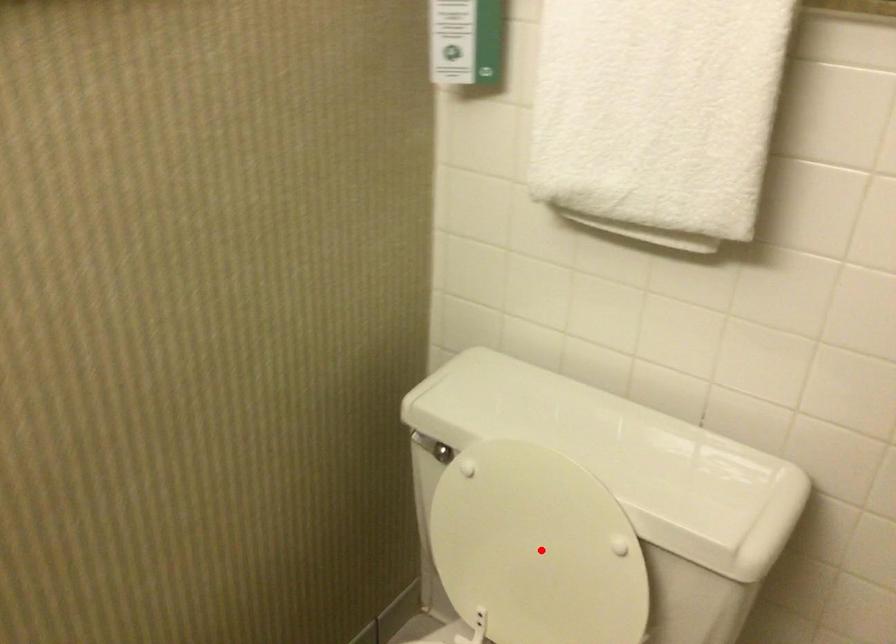
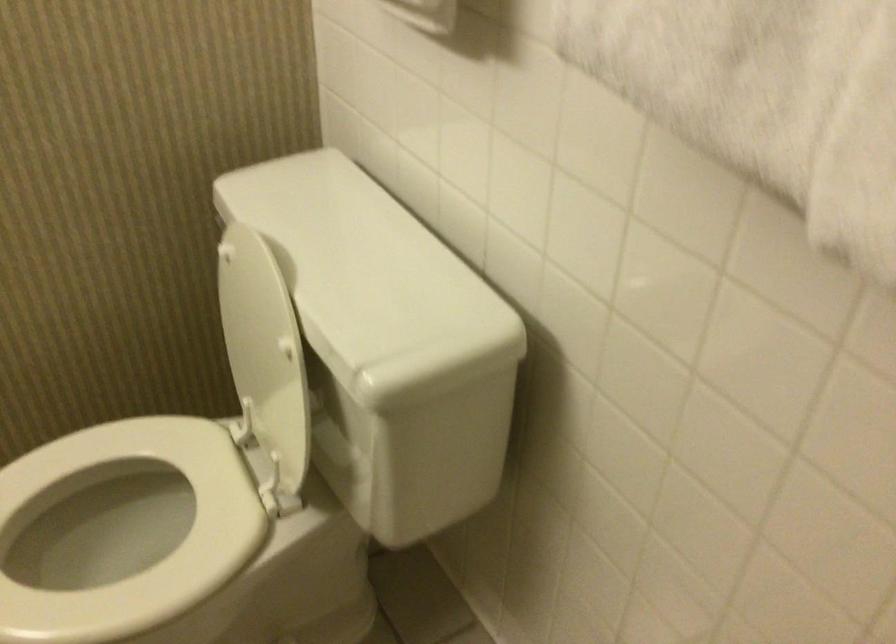
Find the pixel in the second image that matches the highlighted location in the first image.

(259, 343)